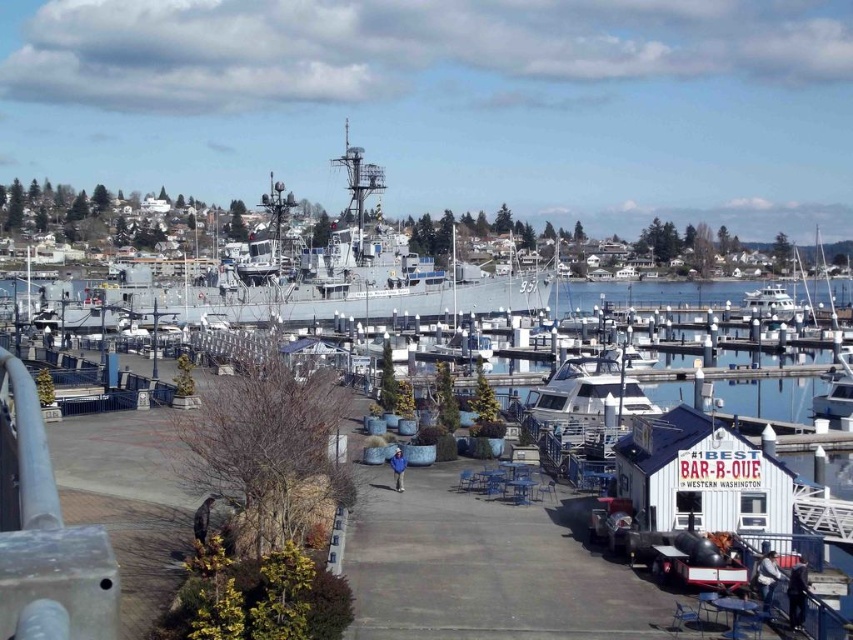
Question: Does white glossy boat at center appear over white glossy yacht at right?

Choices:
 (A) no
 (B) yes

Answer: (A)

Question: Which point is closer to the camera?

Choices:
 (A) white glossy yacht at right
 (B) gray metallic ship at center

Answer: (B)

Question: Which point is farther to the camera?

Choices:
 (A) (780, 312)
 (B) (608, 371)

Answer: (A)

Question: Which point appears farthest from the camera in this image?

Choices:
 (A) [x=581, y=356]
 (B) [x=363, y=179]
 (C) [x=795, y=307]

Answer: (C)

Question: Can you confirm if white glossy boat at center is thinner than white glossy yacht at right?

Choices:
 (A) no
 (B) yes

Answer: (B)

Question: Can you confirm if gray metallic ship at center is positioned to the left of white glossy boat at center?

Choices:
 (A) no
 (B) yes

Answer: (B)